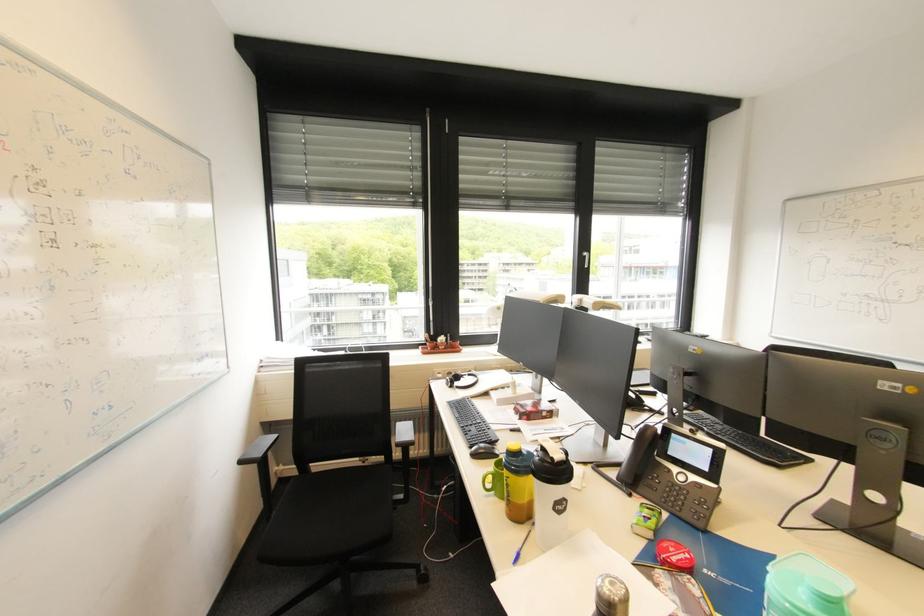
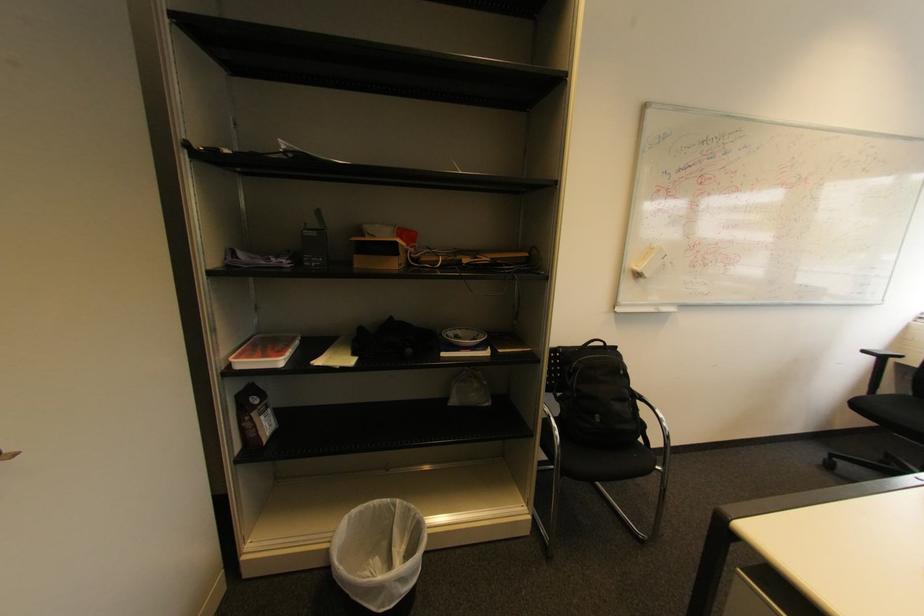
Locate, in the second image, the point that corresponds to point 247,463 in the first image.

(869, 352)